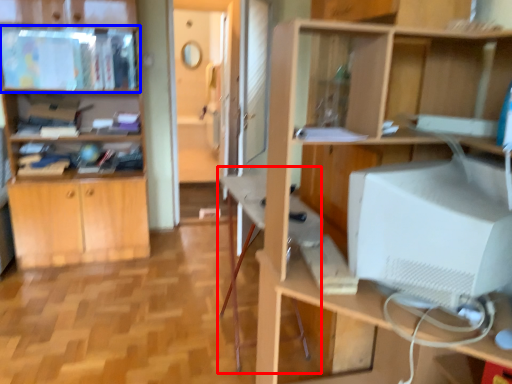
Question: Which object appears farthest to the camera in this image, computer desk (highlighted by a red box) or cabinet (highlighted by a blue box)?

Choices:
 (A) computer desk
 (B) cabinet

Answer: (B)